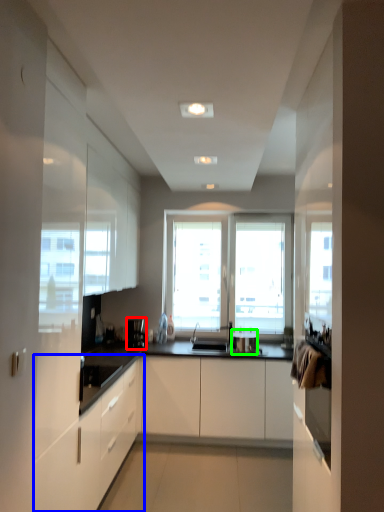
Question: Estimate the real-world distances between objects in this image. Which object is farther from coffee machine (highlighted by a red box), cabinetry (highlighted by a blue box) or appliance (highlighted by a green box)?

Choices:
 (A) cabinetry
 (B) appliance

Answer: (A)